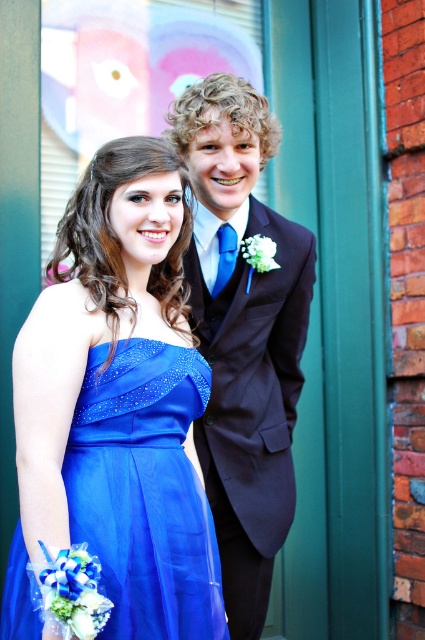
Is point (200, 195) positioned after point (271, 548)?

No, it is not.

Which is more to the left, shiny dark suit at center or blue satin dress at center?

Positioned to the left is shiny dark suit at center.

Is point (204, 202) positioned in front of point (269, 468)?

Yes, point (204, 202) is closer to viewer.

Identify the location of shiny dark suit at center. The image size is (425, 640). (243, 336).

At what (x,y) coordinates should I click in order to perform the action: click on shiny dark suit at center. Please return your answer as a coordinate pair (x, y). The width and height of the screenshot is (425, 640). Looking at the image, I should click on (243, 336).

Does point (243, 112) come closer to viewer compared to point (107, 353)?

No, (243, 112) is further to viewer.

Who is more forward, (232, 490) or (200, 541)?

Positioned in front is point (200, 541).

Find the location of a particular element. The height and width of the screenshot is (640, 425). shiny dark suit at center is located at coordinates (243, 336).

Is blue satin dress at center to the left of shiny blue dress at center from the viewer's perspective?

No, blue satin dress at center is not to the left of shiny blue dress at center.

Identify the location of blue satin dress at center. (243, 333).